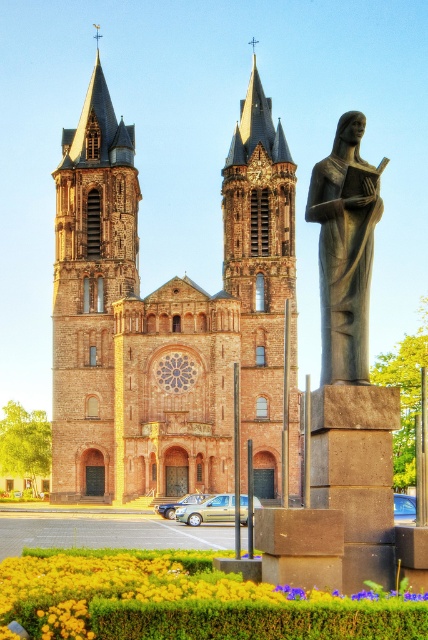
You are an architect assessing the proportions of the church and statue. Given that the gray stone statue at right is 2 meters wide, can you estimate the minimum width of the brown stone church towers at center?

The brown stone church towers at center are wider than the gray stone statue at right, which is 2 meters wide. Therefore, the minimum width of the brown stone church towers at center must be greater than 2 meters.